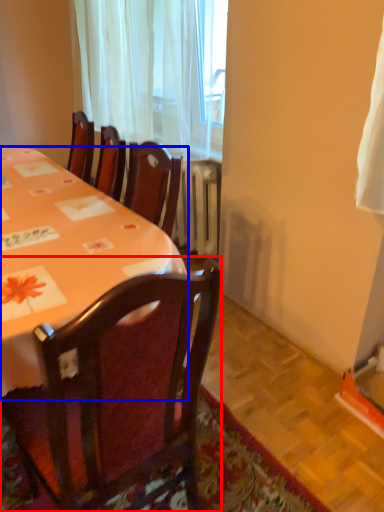
Question: Which of the following is the closest to the observer, chair (highlighted by a red box) or desk (highlighted by a blue box)?

Choices:
 (A) chair
 (B) desk

Answer: (A)